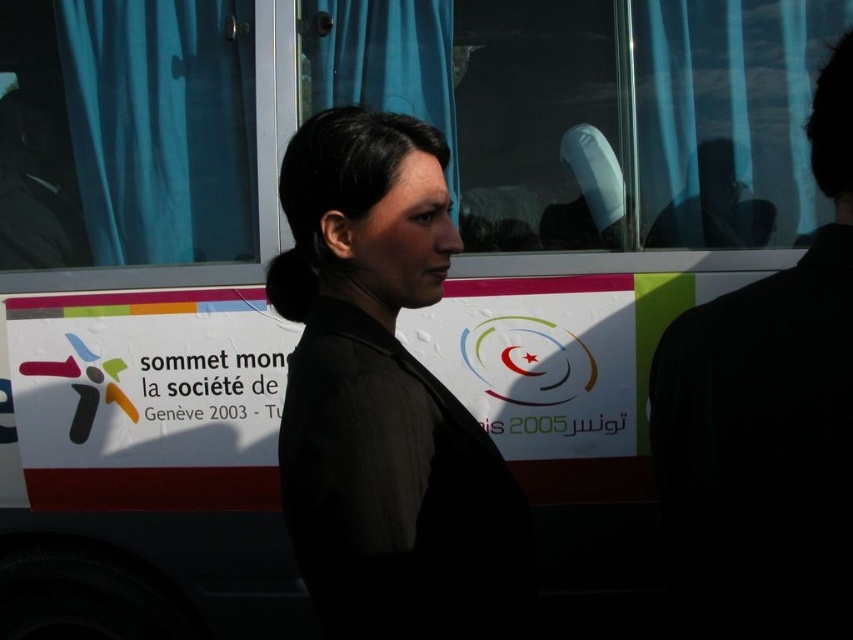
Question: Which of the following is the closest to the observer?

Choices:
 (A) (819, 483)
 (B) (277, 305)

Answer: (A)

Question: Is black matte jacket at center closer to camera compared to black fabric coat at right?

Choices:
 (A) yes
 (B) no

Answer: (B)

Question: Is black matte jacket at center further to camera compared to black fabric coat at right?

Choices:
 (A) no
 (B) yes

Answer: (B)

Question: Which point is closer to the camera?

Choices:
 (A) black matte jacket at center
 (B) black fabric coat at right

Answer: (B)

Question: Is black matte jacket at center to the left of black fabric coat at right from the viewer's perspective?

Choices:
 (A) no
 (B) yes

Answer: (B)